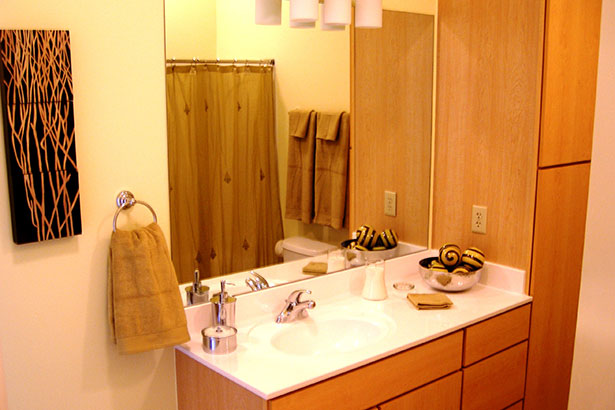
Where is `drawer`? The width and height of the screenshot is (615, 410). drawer is located at coordinates (489, 343), (493, 387), (441, 399).